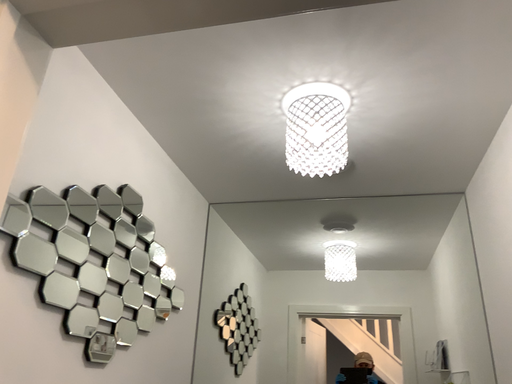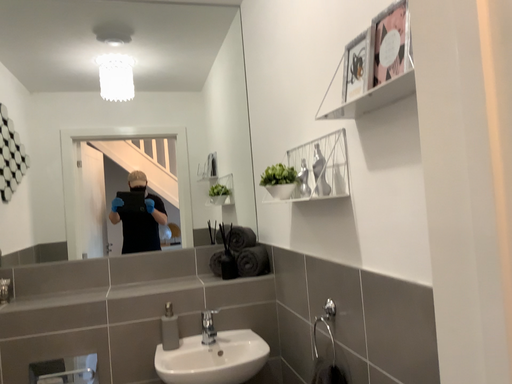
Question: Which way did the camera rotate in the video?

Choices:
 (A) rotated upward
 (B) rotated downward

Answer: (B)